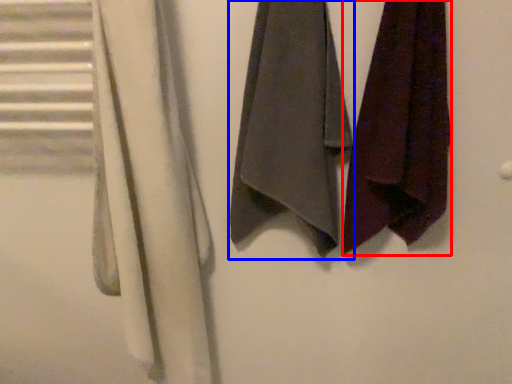
Question: Which point is further to the camera, towel (highlighted by a red box) or towel (highlighted by a blue box)?

Choices:
 (A) towel
 (B) towel

Answer: (B)